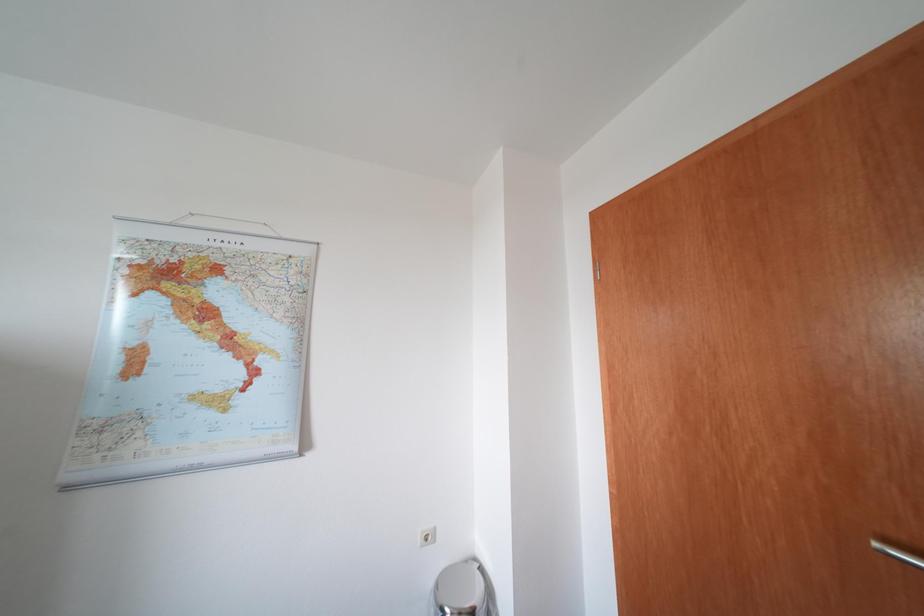
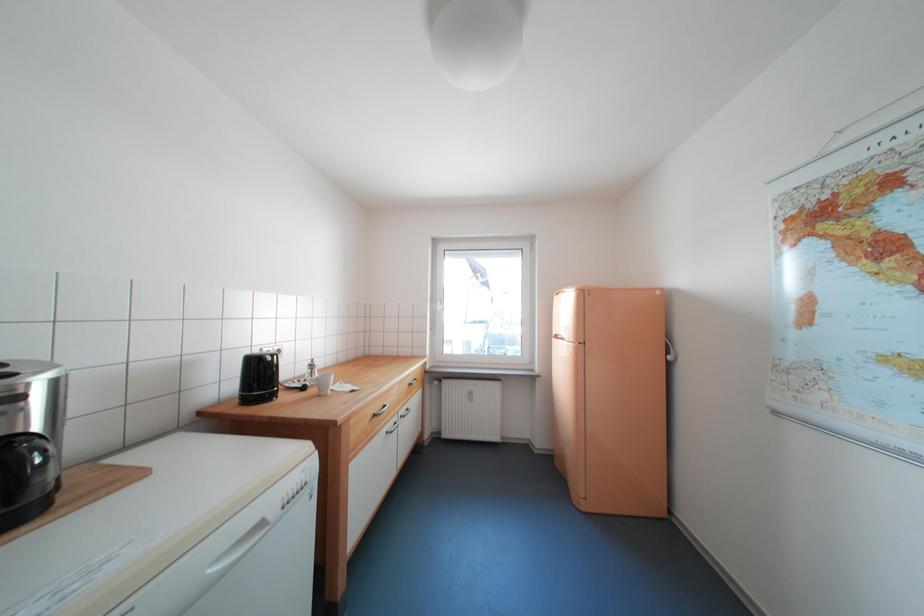
Question: The images are taken continuously from a first-person perspective. In which direction is your viewpoint rotating?

Choices:
 (A) Left
 (B) Right
 (C) Up
 (D) Down

Answer: (A)